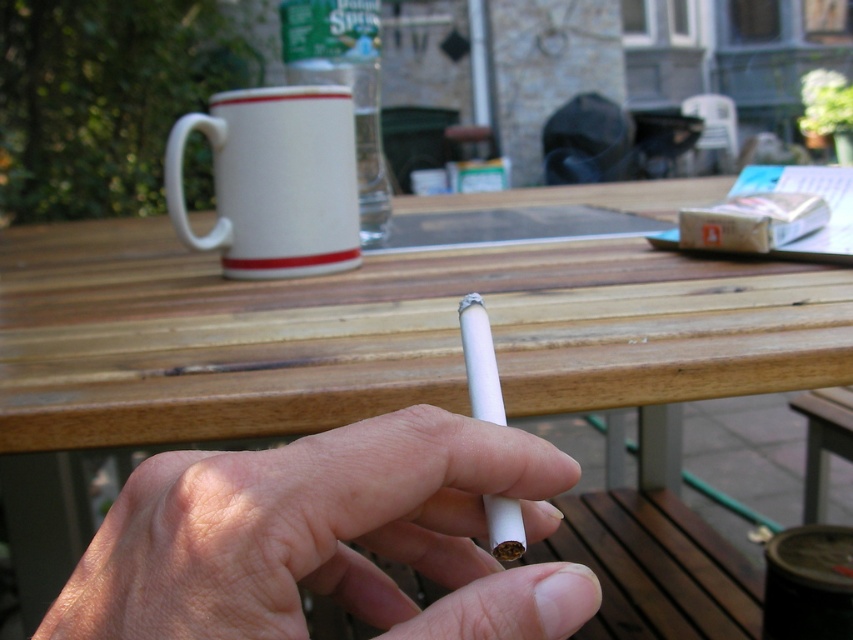
You are a bartender preparing a drink. You need to place the white matte cigarette at center and the white ceramic mug at upper center on a shelf. Which object should you place first if you want to place the smaller item closer to the edge of the shelf?

The white matte cigarette at center should be placed first because it is smaller than the white ceramic mug at upper center, so you can position it closer to the edge of the shelf before placing the larger mug.